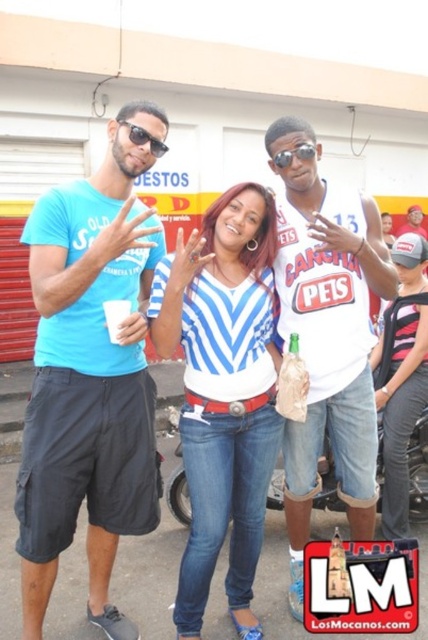
Question: Estimate the real-world distances between objects in this image. Which object is farther from the white jersey at center?

Choices:
 (A) sunglasses at center
 (B) metallic silver motorcycle at center
 (C) matte blue t-shirt at left

Answer: (A)

Question: Is white jersey at center smaller than sunglasses at center?

Choices:
 (A) no
 (B) yes

Answer: (A)

Question: Among these points, which one is nearest to the camera?

Choices:
 (A) pos(404,280)
 (B) pos(357,486)

Answer: (B)

Question: Observing the image, what is the correct spatial positioning of striped jersey at center in reference to sunglasses at center?

Choices:
 (A) below
 (B) above

Answer: (A)

Question: Observing the image, what is the correct spatial positioning of blue striped shirt at center in reference to black plastic sunglasses at center?

Choices:
 (A) left
 (B) right

Answer: (A)

Question: Which object is the farthest from the sunglasses at center?

Choices:
 (A) blue striped shirt at center
 (B) metallic silver motorcycle at center
 (C) matte blue t-shirt at left

Answer: (B)